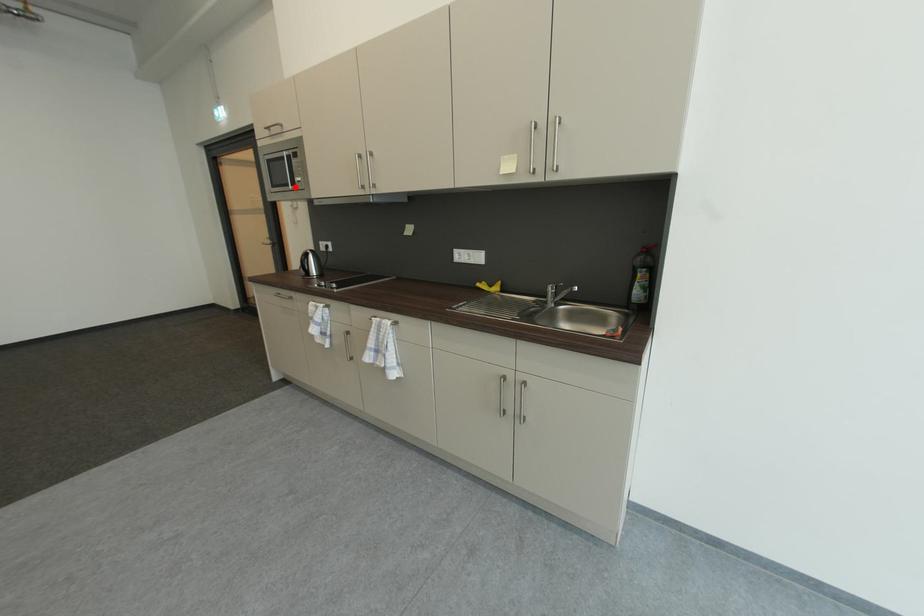
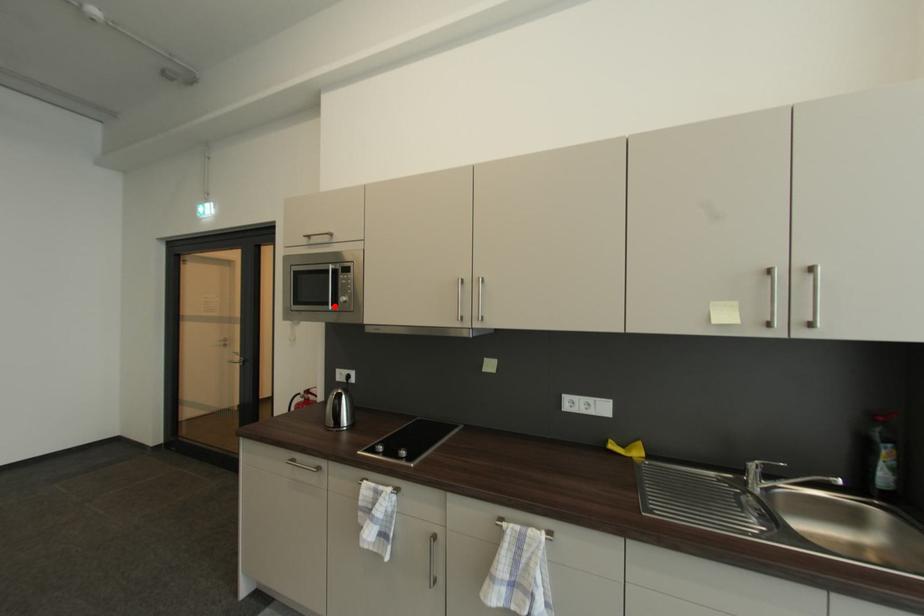
I am providing you with two images of the same scene from different viewpoints. A red point is marked on the first image and another point is marked on the second image. Does the point marked in image1 correspond to the same location as the one in image2?

Yes